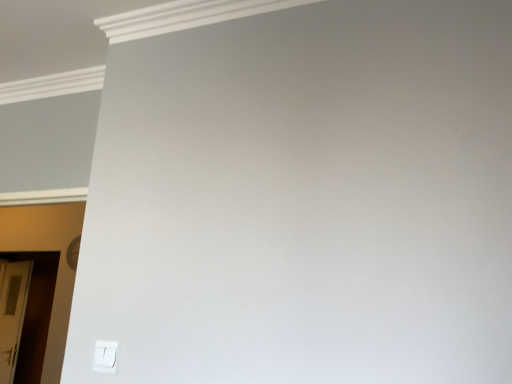
In order to click on white glossy door at lower left in this screenshot , I will do `click(12, 314)`.

This screenshot has width=512, height=384. What do you see at coordinates (12, 314) in the screenshot?
I see `white glossy door at lower left` at bounding box center [12, 314].

Find the location of a particular element. The height and width of the screenshot is (384, 512). white glossy door at lower left is located at coordinates coord(12,314).